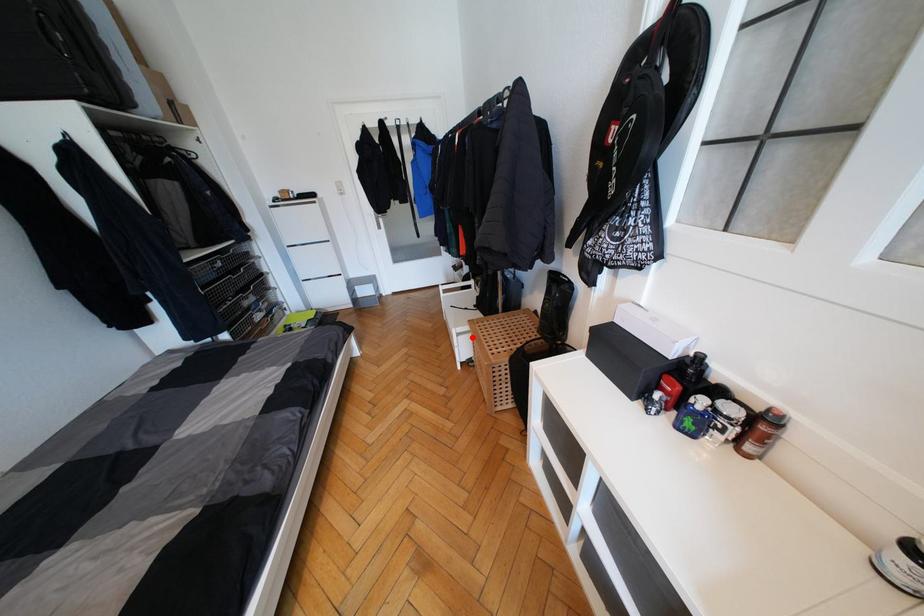
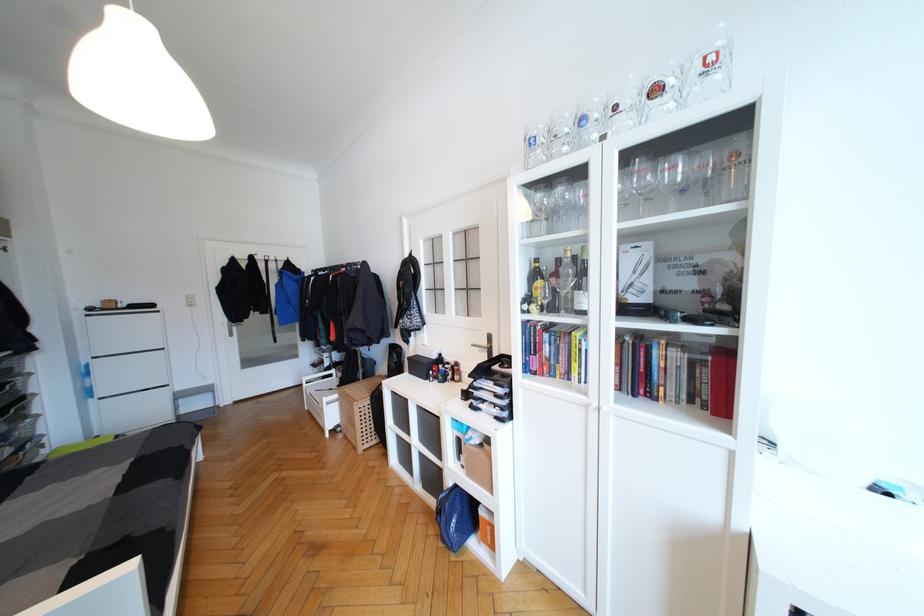
Question: I am providing you with two images of the same scene from different viewpoints. Image1 has a red point marked. In image2, the corresponding 3D location appears at what relative position? Reply with the corresponding letter.

Choices:
 (A) Closer
 (B) Farther

Answer: (B)